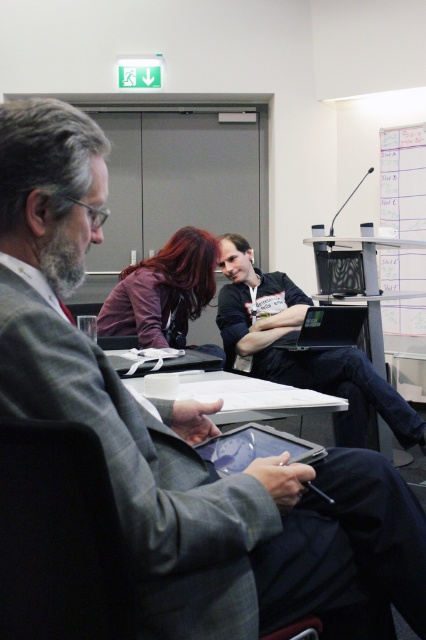
You are a participant in the meeting and need to access the laptop closest to you. Which laptop should you choose between the black fabric laptop at center and the black glossy laptop at center?

The black fabric laptop at center is in front of the black glossy laptop at center, so you should choose the black fabric laptop at center as it is closer to you.

Based on the photo, you are a person standing at the point with coordinates point (302, 352) in the image. What object are you standing on?

The point (302, 352) indicates black fabric laptop at center.

You are a photographer taking a picture of the dark purple fabric shirt at center and the black glossy laptop at center. Which object should you focus on first if you want to ensure both are in focus?

The dark purple fabric shirt at center is positioned over the black glossy laptop at center, so focusing on the dark purple fabric shirt at center first will ensure both are in focus since it is closer to the camera.